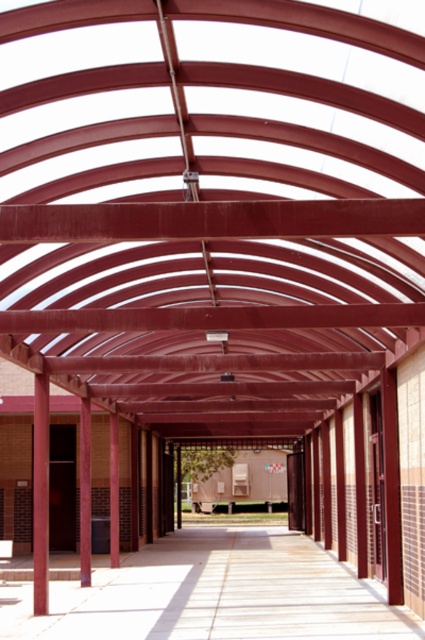
You are standing at the entrance of the covered walkway and see two points marked on the walkway. The first point is at coordinates point (396, 140) and the second is at point (200, 608). Which point is closer to you?

Point (396, 140) is closer to the viewer than point (200, 608).

You are a maintenance worker needing to inspect the metallic red roof at center and the smooth concrete walkway at center. The safety regulations state that you must stay at least 5 meters away from any structure during inspections. Can you safely perform the inspection from your current position without moving closer?

The metallic red roof at center is 5.34 meters from the smooth concrete walkway at center. Since the distance between them is more than 5 meters, you can safely perform the inspection from your current position without moving closer.

You are planning to install a new lighting system along the walkway. Given that the metallic red roof at center is larger than the smooth concrete walkway at center, which object would require more lighting fixtures to cover its entire area?

The metallic red roof at center requires more lighting fixtures because it is larger in size than the smooth concrete walkway at center.